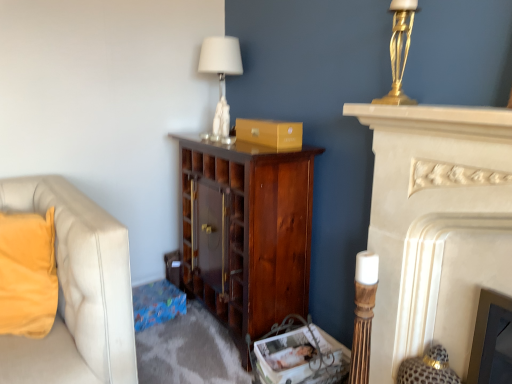
This screenshot has width=512, height=384. Describe the element at coordinates (221, 74) in the screenshot. I see `white fabric lampshade at upper center` at that location.

Identify the location of matte gold cardboard box at center. (270, 133).

Find the location of a particular element. The image size is (512, 384). gold metallic lamp at upper right is located at coordinates (399, 50).

The width and height of the screenshot is (512, 384). Find the location of `white marble fireplace at right`. white marble fireplace at right is located at coordinates [x=436, y=226].

What is the approximate width of white marble fireplace at right?

6.56 inches.

Where is `velvet yellow pillow at left`? velvet yellow pillow at left is located at coordinates 76,292.

Locate an element on the screen. This screenshot has height=384, width=512. white fabric lampshade at upper center is located at coordinates (221, 74).

Is dark wood cabinet at center facing away from white marble fireplace at right?

That's not correct — dark wood cabinet at center is not looking away from white marble fireplace at right.

Would you say white marble fireplace at right is part of dark wood cabinet at center's contents?

That's incorrect, white marble fireplace at right is not inside dark wood cabinet at center.

From the image's perspective, is dark wood cabinet at center located above white marble fireplace at right?

Indeed, from the image's perspective, dark wood cabinet at center is shown above white marble fireplace at right.

From a real-world perspective, which is physically below, dark wood cabinet at center or white marble fireplace at right?

dark wood cabinet at center, from a real-world perspective.

Between gold metallic lamp at upper right and white fabric lampshade at upper center, which one has larger size?

white fabric lampshade at upper center.

Is gold metallic lamp at upper right situated inside white fabric lampshade at upper center or outside?

gold metallic lamp at upper right lies outside white fabric lampshade at upper center.

Is gold metallic lamp at upper right further to camera compared to white fabric lampshade at upper center?

No, gold metallic lamp at upper right is closer to the viewer.

Can you confirm if gold metallic lamp at upper right is thinner than white fabric lampshade at upper center?

Yes, gold metallic lamp at upper right is thinner than white fabric lampshade at upper center.

Looking at this image, is matte gold cardboard box at center smaller than gold metallic lamp at upper right?

Actually, matte gold cardboard box at center might be larger than gold metallic lamp at upper right.

You are a GUI agent. You are given a task and a screenshot of the screen. Output one action in this format:
    pyautogui.click(x=<x>, y=<y>)
    Task: Click on the cardboard box behind the gold metallic lamp at upper right
    This screenshot has width=512, height=384.
    Given the screenshot: What is the action you would take?
    pyautogui.click(x=270, y=133)

From the image's perspective, is matte gold cardboard box at center under gold metallic lamp at upper right?

Yes, from the image's perspective, matte gold cardboard box at center is beneath gold metallic lamp at upper right.

Considering the sizes of matte gold cardboard box at center and gold metallic lamp at upper right in the image, is matte gold cardboard box at center taller or shorter than gold metallic lamp at upper right?

Considering their sizes, matte gold cardboard box at center has less height than gold metallic lamp at upper right.

Is dark wood cabinet at center with matte gold cardboard box at center?

dark wood cabinet at center and matte gold cardboard box at center are not in contact.

Who is smaller, dark wood cabinet at center or matte gold cardboard box at center?

Smaller between the two is matte gold cardboard box at center.

Is dark wood cabinet at center taller than matte gold cardboard box at center?

Yes, dark wood cabinet at center is taller than matte gold cardboard box at center.

Can you confirm if dark wood cabinet at center is positioned to the left of matte gold cardboard box at center?

Yes, dark wood cabinet at center is to the left of matte gold cardboard box at center.

Looking at this image, considering the sizes of objects white fabric lampshade at upper center and white marble fireplace at right in the image provided, who is bigger, white fabric lampshade at upper center or white marble fireplace at right?

With larger size is white marble fireplace at right.

Consider the image. What's the angular difference between white fabric lampshade at upper center and white marble fireplace at right's facing directions?

0.000658 degrees.

Would you say white fabric lampshade at upper center is inside or outside white marble fireplace at right?

white fabric lampshade at upper center is not enclosed by white marble fireplace at right.

From the image's perspective, which is below, white fabric lampshade at upper center or white marble fireplace at right?

white marble fireplace at right is shown below in the image.

Is the depth of velvet yellow pillow at left less than that of gold metallic lamp at upper right?

That is False.

Is velvet yellow pillow at left smaller than gold metallic lamp at upper right?

Incorrect, velvet yellow pillow at left is not smaller in size than gold metallic lamp at upper right.

Which object is positioned more to the right, velvet yellow pillow at left or gold metallic lamp at upper right?

Positioned to the right is gold metallic lamp at upper right.

Is velvet yellow pillow at left oriented towards gold metallic lamp at upper right?

No, velvet yellow pillow at left is not turned towards gold metallic lamp at upper right.

Is white marble fireplace at right oriented towards gold metallic lamp at upper right?

No, white marble fireplace at right is not oriented towards gold metallic lamp at upper right.

Which is more to the left, white marble fireplace at right or gold metallic lamp at upper right?

From the viewer's perspective, gold metallic lamp at upper right appears more on the left side.

At what (x,y) coordinates should I click in order to perform the action: click on lamp on the left of white marble fireplace at right. Please return your answer as a coordinate pair (x, y). Looking at the image, I should click on (399, 50).

Who is more distant, white marble fireplace at right or gold metallic lamp at upper right?

gold metallic lamp at upper right is further from the camera.

Locate an element on the screen. This screenshot has height=384, width=512. fireplace above the dark wood cabinet at center (from a real-world perspective) is located at coordinates (436, 226).

This screenshot has height=384, width=512. In order to click on lamp in front of the white fabric lampshade at upper center in this screenshot , I will do `click(399, 50)`.

From the image, which object appears to be nearer to velvet yellow pillow at left, white marble fireplace at right or gold metallic lamp at upper right?

white marble fireplace at right is positioned closer to the anchor velvet yellow pillow at left.

Looking at this image, which object lies further to the anchor point white fabric lampshade at upper center, matte gold cardboard box at center or velvet yellow pillow at left?

Based on the image, velvet yellow pillow at left appears to be further to white fabric lampshade at upper center.

Based on their spatial positions, is white marble fireplace at right or dark wood cabinet at center further from gold metallic lamp at upper right?

Among the two, dark wood cabinet at center is located further to gold metallic lamp at upper right.

Which object lies nearer to the anchor point white marble fireplace at right, dark wood cabinet at center or matte gold cardboard box at center?

The object closer to white marble fireplace at right is matte gold cardboard box at center.

Considering their positions, is gold metallic lamp at upper right positioned closer to white fabric lampshade at upper center than matte gold cardboard box at center?

Based on the image, matte gold cardboard box at center appears to be nearer to white fabric lampshade at upper center.

When comparing their distances from dark wood cabinet at center, does matte gold cardboard box at center or velvet yellow pillow at left seem further?

velvet yellow pillow at left lies further to dark wood cabinet at center than the other object.

Which object lies nearer to the anchor point velvet yellow pillow at left, matte gold cardboard box at center or white fabric lampshade at upper center?

Among the two, matte gold cardboard box at center is located nearer to velvet yellow pillow at left.

Based on the photo, estimate the real-world distances between objects in this image. Which object is closer to matte gold cardboard box at center, gold metallic lamp at upper right or velvet yellow pillow at left?

gold metallic lamp at upper right is closer to matte gold cardboard box at center.

At what (x,y) coordinates should I click in order to perform the action: click on cardboard box between white fabric lampshade at upper center and dark wood cabinet at center vertically. Please return your answer as a coordinate pair (x, y). Image resolution: width=512 pixels, height=384 pixels. Looking at the image, I should click on (270, 133).

The image size is (512, 384). I want to click on cardboard box between gold metallic lamp at upper right and white marble fireplace at right from top to bottom, so click(270, 133).

You are a GUI agent. You are given a task and a screenshot of the screen. Output one action in this format:
    pyautogui.click(x=<x>, y=<y>)
    Task: Click on the cabinetry between white marble fireplace at right and white fabric lampshade at upper center from front to back
    The width and height of the screenshot is (512, 384).
    Given the screenshot: What is the action you would take?
    pyautogui.click(x=246, y=232)

Find the location of a particular element. The width and height of the screenshot is (512, 384). cardboard box between gold metallic lamp at upper right and white fabric lampshade at upper center along the z-axis is located at coordinates (270, 133).